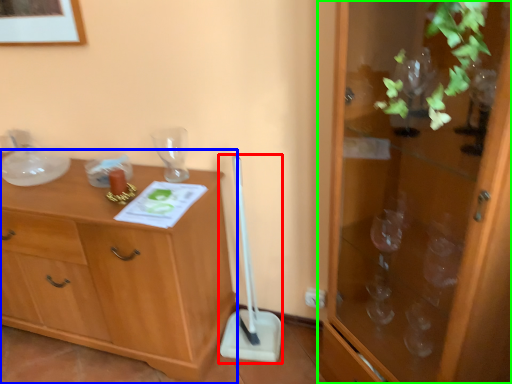
Question: Considering the real-world distances, which object is closest to shovel (highlighted by a red box)? chest of drawers (highlighted by a blue box) or cabinetry (highlighted by a green box).

Choices:
 (A) chest of drawers
 (B) cabinetry

Answer: (A)